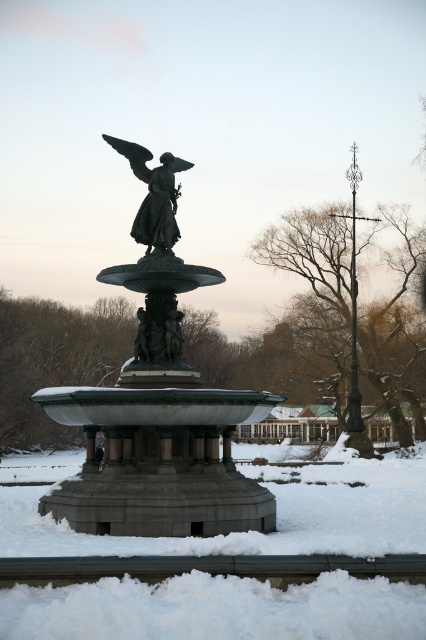
The image size is (426, 640). Describe the element at coordinates (215, 609) in the screenshot. I see `white fluffy snow at center` at that location.

Which of these two, white fluffy snow at center or polished bronze angel at center, stands shorter?

With less height is polished bronze angel at center.

Describe the element at coordinates (215, 609) in the screenshot. I see `white fluffy snow at center` at that location.

I want to click on white fluffy snow at center, so click(215, 609).

Locate an element on the screen. white fluffy snow at center is located at coordinates (215, 609).

Is white fluffy snow at center to the left of bronze statue at center from the viewer's perspective?

In fact, white fluffy snow at center is to the right of bronze statue at center.

This screenshot has width=426, height=640. Find the location of `white fluffy snow at center`. white fluffy snow at center is located at coordinates (215, 609).

Does bronze statue at center have a smaller size compared to polished bronze angel at center?

Incorrect, bronze statue at center is not smaller in size than polished bronze angel at center.

Identify the location of bronze statue at center. This screenshot has height=640, width=426. (158, 403).